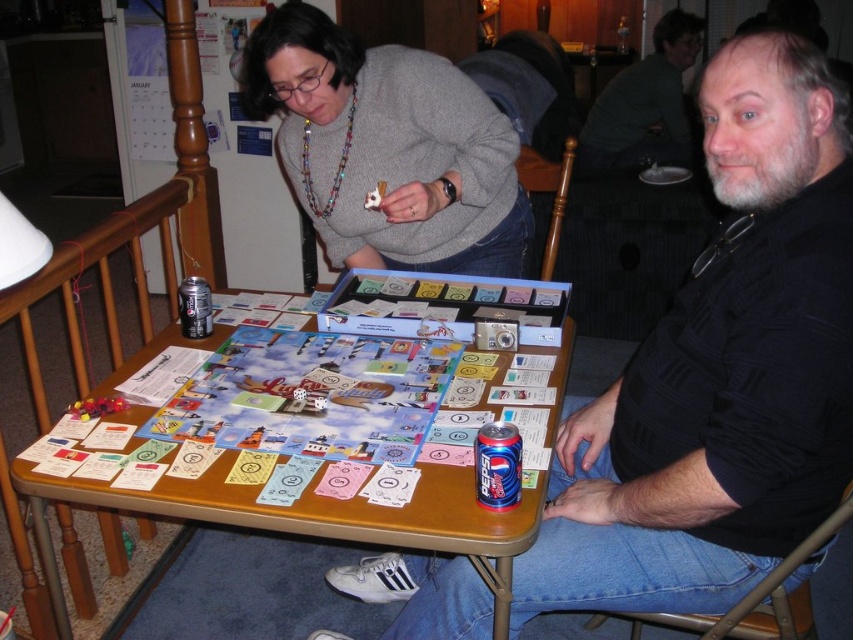
Is point (583, 132) closer to viewer compared to point (206, 308)?

No, it is not.

Is point (618, 125) positioned behind point (199, 289)?

Yes, it is behind point (199, 289).

Identify the location of dark gray shirt at upper right. (645, 104).

Find the location of a particular element. dark gray shirt at upper right is located at coordinates (645, 104).

How distant is gray sweater at upper center from dark gray shirt at upper right?

A distance of 5.40 feet exists between gray sweater at upper center and dark gray shirt at upper right.

Find the location of a particular element. The height and width of the screenshot is (640, 853). gray sweater at upper center is located at coordinates (387, 148).

Does wooden table at center have a greater width compared to dark gray shirt at upper right?

Indeed, wooden table at center has a greater width compared to dark gray shirt at upper right.

Between wooden table at center and dark gray shirt at upper right, which one has more height?

dark gray shirt at upper right

Where is `wooden table at center`? The width and height of the screenshot is (853, 640). wooden table at center is located at coordinates (305, 516).